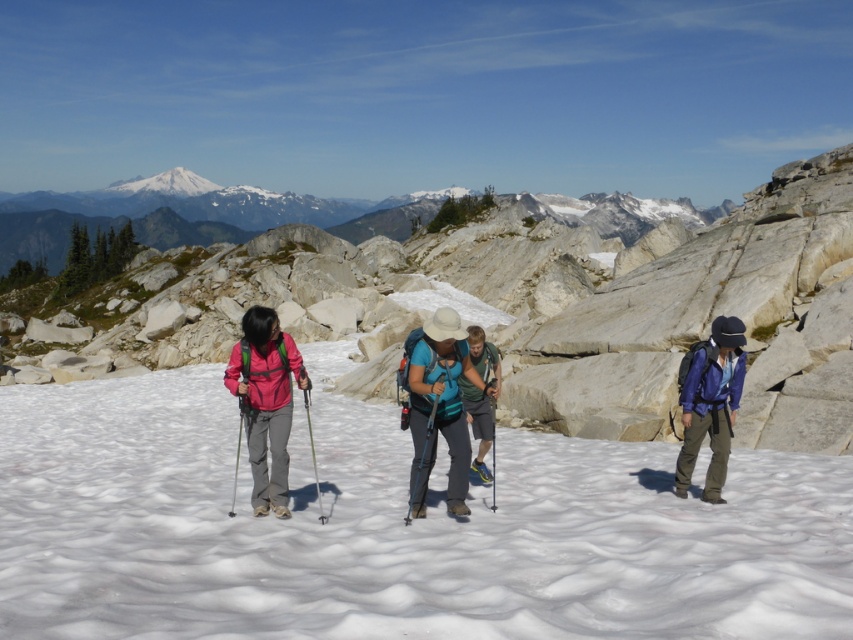
Can you confirm if matte blue shirt at center is positioned to the right of black plastic ski pole at center?

Incorrect, matte blue shirt at center is not on the right side of black plastic ski pole at center.

What do you see at coordinates (439, 408) in the screenshot?
I see `matte blue shirt at center` at bounding box center [439, 408].

Identify the location of matte blue shirt at center. Image resolution: width=853 pixels, height=640 pixels. (439, 408).

Is matte blue shirt at center positioned before blue fabric backpack at center?

That is True.

This screenshot has height=640, width=853. What do you see at coordinates (439, 408) in the screenshot? I see `matte blue shirt at center` at bounding box center [439, 408].

Does point (468, 360) lie behind point (483, 362)?

No, it is in front of (483, 362).

I want to click on matte blue shirt at center, so click(x=439, y=408).

How distant is white fluffy snow at center from blue fabric backpack at center?

They are 7.30 meters apart.

Measure the distance between white fluffy snow at center and camera.

They are 48.13 feet apart.

You are a GUI agent. You are given a task and a screenshot of the screen. Output one action in this format:
    pyautogui.click(x=<x>, y=<y>)
    Task: Click on the white fluffy snow at center
    This screenshot has height=640, width=853.
    Given the screenshot: What is the action you would take?
    [x=392, y=529]